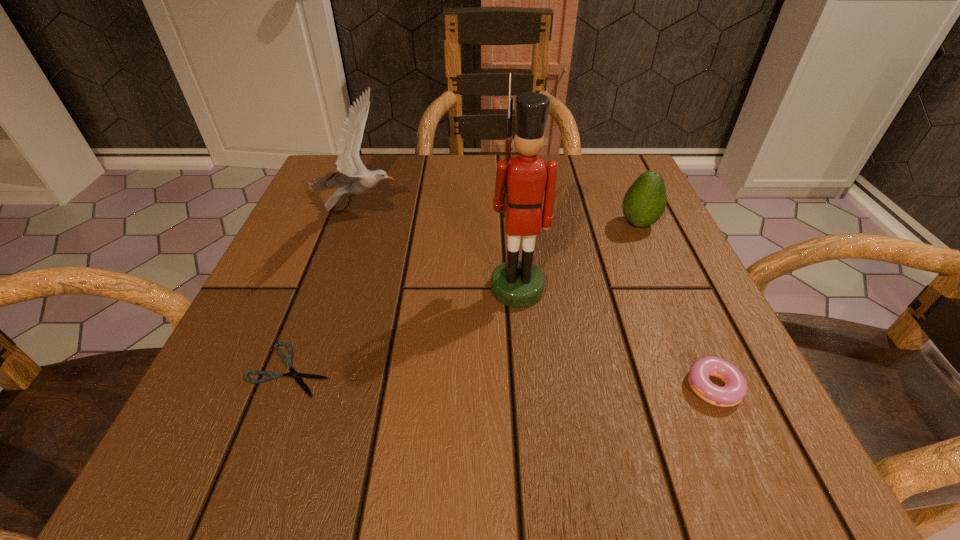
I want to click on nutcracker, so click(520, 183).

What are the coordinates of `the third farthest object` in the screenshot? It's located at (520, 183).

The image size is (960, 540). Identify the location of gull. (353, 177).

Find the location of a particular element. The image size is (960, 540). the third shortest object is located at coordinates (645, 201).

Where is `the second shortest object`? Image resolution: width=960 pixels, height=540 pixels. the second shortest object is located at coordinates (735, 389).

Find the location of a particular element. This screenshot has width=960, height=540. shears is located at coordinates (288, 361).

Locate an element on the screen. free space located 0.120m on the front-facing side of the nutcracker is located at coordinates (524, 372).

Locate an element on the screen. The width and height of the screenshot is (960, 540). free location located 0.210m at the tip of the beak of the gull is located at coordinates (500, 211).

Where is `free location located on the left of the avocado`? free location located on the left of the avocado is located at coordinates (558, 224).

The width and height of the screenshot is (960, 540). Identify the location of vacant area located 0.080m on the front of the second shortest object. (758, 472).